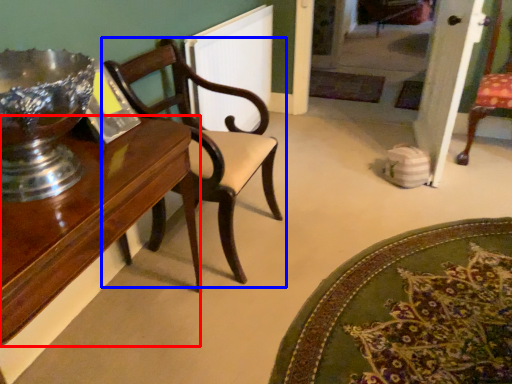
Question: Which object is closer to the camera taking this photo, table (highlighted by a red box) or chair (highlighted by a blue box)?

Choices:
 (A) table
 (B) chair

Answer: (A)